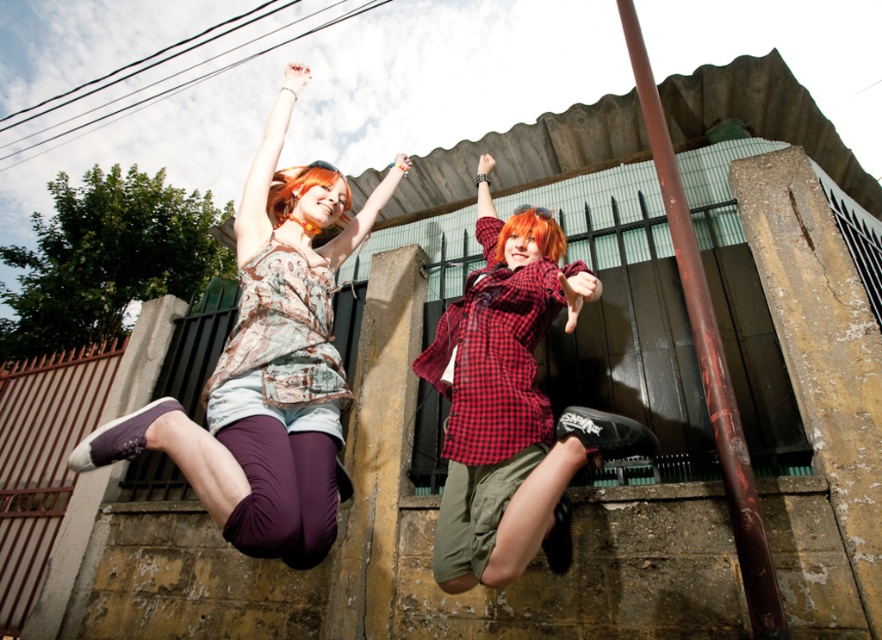
You are a photographer trying to capture the matte brown tank top at upper left in the image. According to the coordinates provided, where should you focus your camera to ensure it is centered in the frame?

The matte brown tank top at upper left is located at point coordinates of (267, 374), so you should focus your camera there to center it.

You are a photographer trying to capture the perfect shot of the two individuals jumping. You notice a smooth brown pole at upper right in the background. Based on its position, would this pole likely appear in the upper half or lower half of your photo?

The smooth brown pole at upper right is located at point (708, 355), which places it in the upper half of the photo.

You are a photographer trying to capture both the orange dyed hair at upper center and the orange matte hair at center in a single frame. Based on their sizes in the image, which hair style would appear larger in the photo?

The orange dyed hair at upper center would appear larger in the photo since it is bigger than the orange matte hair at center.